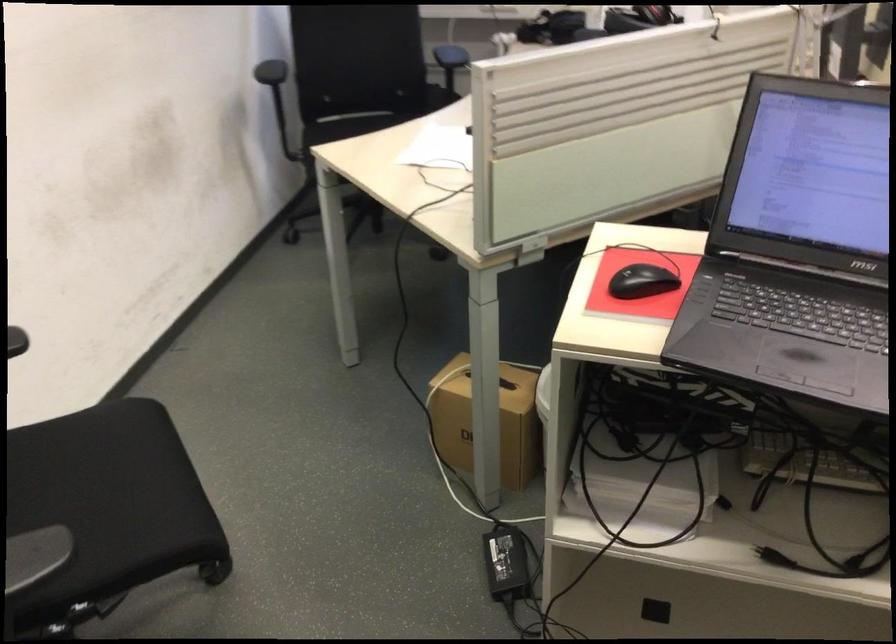
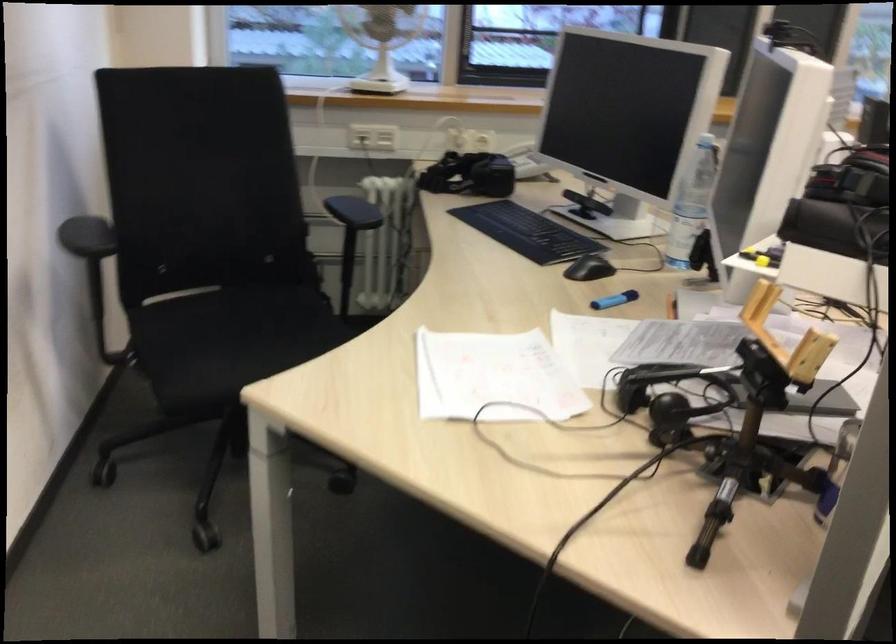
Looking at this image, the images are taken continuously from a first-person perspective. In which direction are you moving?

The cameraman moved toward left, forward.